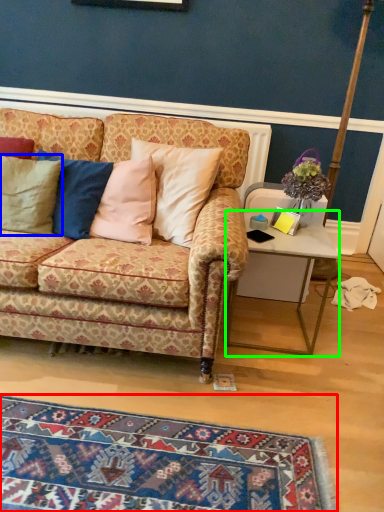
Question: Estimate the real-world distances between objects in this image. Which object is farther from mat (highlighted by a red box), pillow (highlighted by a blue box) or desk (highlighted by a green box)?

Choices:
 (A) pillow
 (B) desk

Answer: (A)